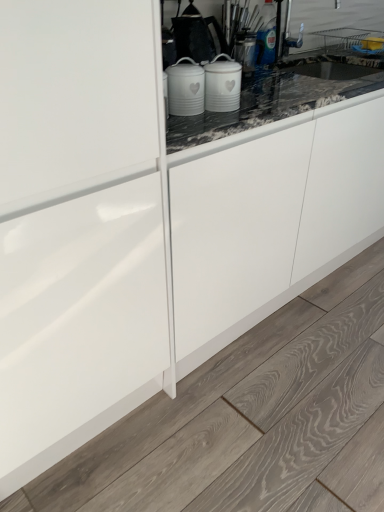
Identify the location of white matte canisters at center. (185, 88).

Describe the element at coordinates (185, 88) in the screenshot. This screenshot has width=384, height=512. I see `white matte canisters at center` at that location.

In order to face white matte canisters at center, should I rotate leftwards or rightwards?

Rotate left and turn 0.754 degrees.

The width and height of the screenshot is (384, 512). Describe the element at coordinates (222, 84) in the screenshot. I see `white matte canisters at center` at that location.

Identify the location of white matte canisters at center. (222, 84).

Find the location of `white matte canisters at center`. white matte canisters at center is located at coordinates [185, 88].

Between white matte canisters at center and white matte canisters at center, which one appears on the right side from the viewer's perspective?

white matte canisters at center.

Which object is further away from the camera taking this photo, white matte canisters at center or white matte canisters at center?

white matte canisters at center is further away from the camera.

Which is nearer, (234,63) or (188,89)?

Positioned in front is point (188,89).

From the image's perspective, is white matte canisters at center on white matte canisters at center?

Yes, from the image's perspective, white matte canisters at center is above white matte canisters at center.

From a real-world perspective, which is physically below, white matte canisters at center or white matte canisters at center?

white matte canisters at center.

Does white matte canisters at center have a lesser width compared to white matte canisters at center?

Indeed, white matte canisters at center has a lesser width compared to white matte canisters at center.

Is white matte canisters at center shorter than white matte canisters at center?

Correct, white matte canisters at center is not as tall as white matte canisters at center.

From the picture: Can you confirm if white matte canisters at center is bigger than white matte canisters at center?

No.

Is white matte canisters at center not within white matte canisters at center?

Yes, white matte canisters at center is outside of white matte canisters at center.

Are white matte canisters at center and white matte canisters at center making contact?

Indeed, white matte canisters at center and white matte canisters at center are beside each other and touching.

From the picture: Could you tell me if white matte canisters at center is turned towards white matte canisters at center?

No, white matte canisters at center does not turn towards white matte canisters at center.

Can you tell me how much white matte canisters at center and white matte canisters at center differ in facing direction?

0.00286 degrees.

Locate an element on the screen. home appliance in front of the white matte canisters at center is located at coordinates (185, 88).

Considering the relative positions of white matte canisters at center and white matte canisters at center in the image provided, is white matte canisters at center to the right of white matte canisters at center from the viewer's perspective?

No.

Is the depth of white matte canisters at center greater than that of white matte canisters at center?

No, white matte canisters at center is closer to the camera.

Which is closer to the camera, (204, 73) or (209, 104)?

Point (204, 73) is positioned closer to the camera compared to point (209, 104).

Consider the image. From the image's perspective, is white matte canisters at center located above or below white matte canisters at center?

white matte canisters at center is below white matte canisters at center.

In the scene shown: From a real-world perspective, is white matte canisters at center physically above white matte canisters at center?

Yes.

Considering the relative sizes of white matte canisters at center and white matte canisters at center in the image provided, is white matte canisters at center wider than white matte canisters at center?

Indeed, white matte canisters at center has a greater width compared to white matte canisters at center.

Does white matte canisters at center have a greater height compared to white matte canisters at center?

Yes.

Between white matte canisters at center and white matte canisters at center, which one has larger size?

white matte canisters at center.

Is white matte canisters at center situated inside white matte canisters at center or outside?

The correct answer is: outside.

Is white matte canisters at center in contact with white matte canisters at center?

Absolutely, white matte canisters at center is next to and touching white matte canisters at center.

Is white matte canisters at center oriented towards white matte canisters at center?

No, white matte canisters at center is not aimed at white matte canisters at center.

Consider the image. How many degrees apart are the facing directions of white matte canisters at center and white matte canisters at center?

They differ by 0.00286 degrees in their facing directions.

You are a GUI agent. You are given a task and a screenshot of the screen. Output one action in this format:
    pyautogui.click(x=<x>, y=<y>)
    Task: Click on the home appliance that is on the left side of white matte canisters at center
    
    Given the screenshot: What is the action you would take?
    pyautogui.click(x=185, y=88)

Find the location of a particular element. The height and width of the screenshot is (512, 384). kitchen appliance lying on the right of white matte canisters at center is located at coordinates (222, 84).

At what (x,y) coordinates should I click in order to perform the action: click on home appliance located on the left of white matte canisters at center. Please return your answer as a coordinate pair (x, y). Looking at the image, I should click on (185, 88).